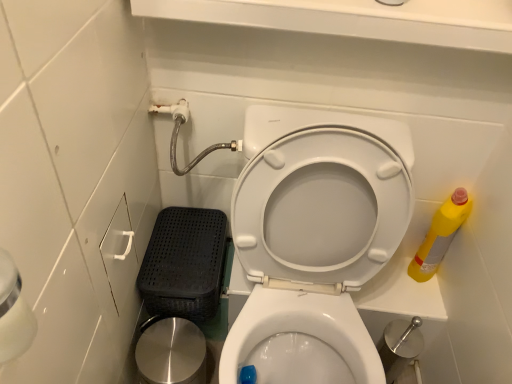
I want to click on free point above polished stainless steel potty at lower left (from a real-world perspective), so click(168, 345).